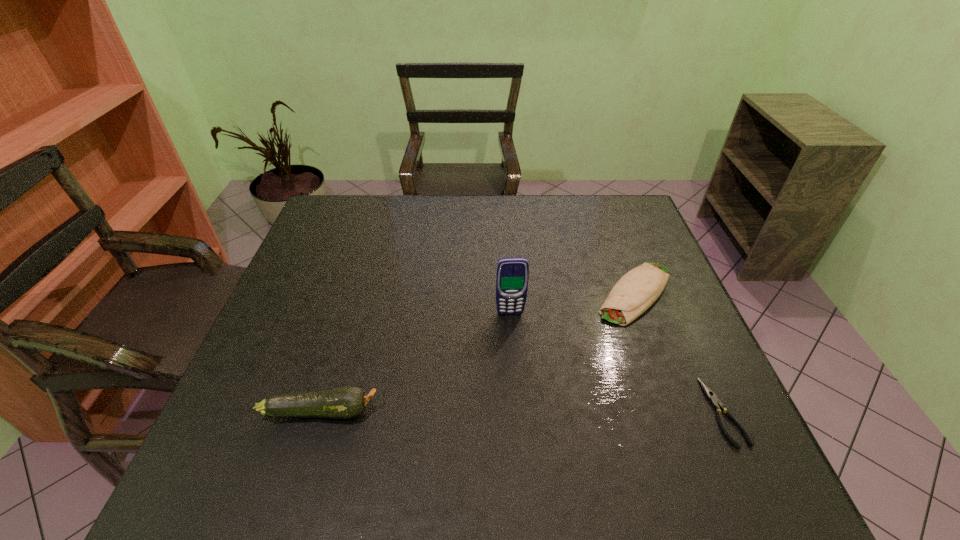
The height and width of the screenshot is (540, 960). I want to click on blank space located at the bitten end of the burrito, so click(x=519, y=422).

At what (x,y) coordinates should I click in order to perform the action: click on free space located on the front-facing side of the cellular telephone. Please return your answer as a coordinate pair (x, y). The height and width of the screenshot is (540, 960). Looking at the image, I should click on (516, 351).

At what (x,y) coordinates should I click in order to perform the action: click on free space located 0.250m on the front-facing side of the cellular telephone. Please return your answer as a coordinate pair (x, y). The height and width of the screenshot is (540, 960). Looking at the image, I should click on (523, 403).

Where is `vacant area situated 0.220m on the front-facing side of the cellular telephone`? This screenshot has width=960, height=540. vacant area situated 0.220m on the front-facing side of the cellular telephone is located at coordinates (521, 392).

The width and height of the screenshot is (960, 540). I want to click on zucchini located at the near edge, so click(345, 402).

Locate an element on the screen. The width and height of the screenshot is (960, 540). pliers located in the near edge section of the desktop is located at coordinates (711, 396).

Locate an element on the screen. This screenshot has width=960, height=540. object situated at the left edge is located at coordinates (345, 402).

What are the coordinates of `pliers present at the right edge` in the screenshot? It's located at (711, 396).

Locate an element on the screen. Image resolution: width=960 pixels, height=540 pixels. burrito at the right edge is located at coordinates click(638, 289).

Where is `object present at the near left corner`? object present at the near left corner is located at coordinates (345, 402).